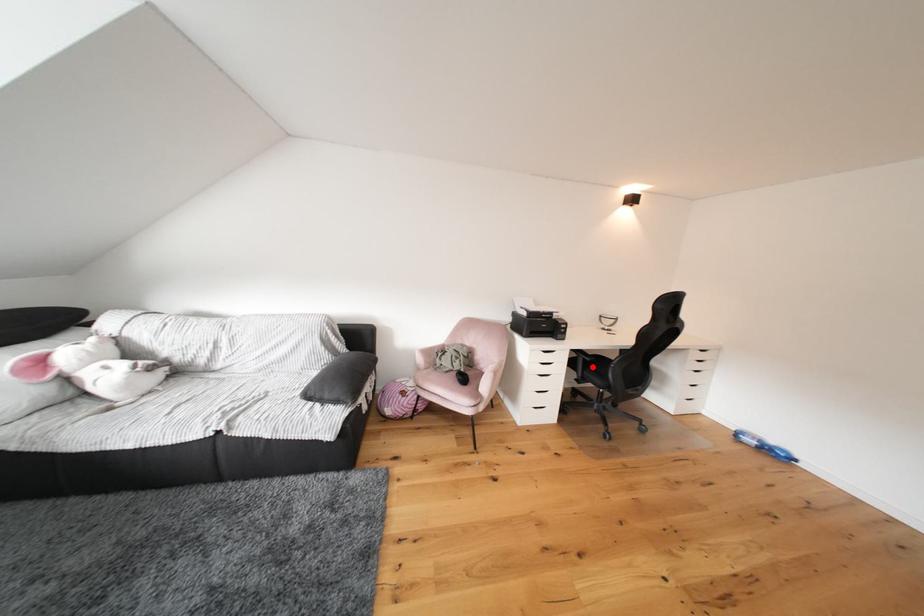
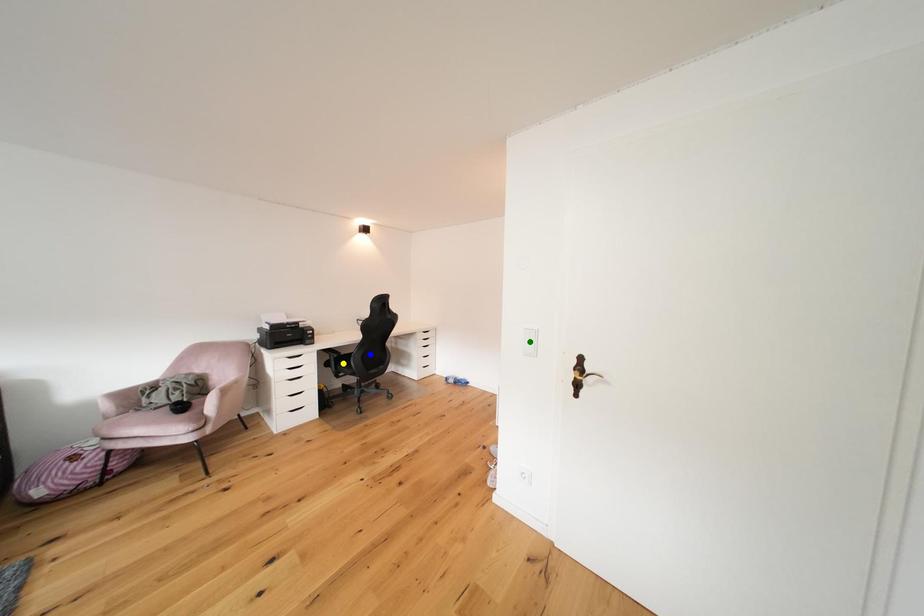
Question: I am providing you with two images of the same scene from different viewpoints. A red point is marked on the first image. You are given multiple points on the second image. In image 2, which mark is for the same physical point as the one in image 1?

Choices:
 (A) blue point
 (B) green point
 (C) yellow point

Answer: (C)